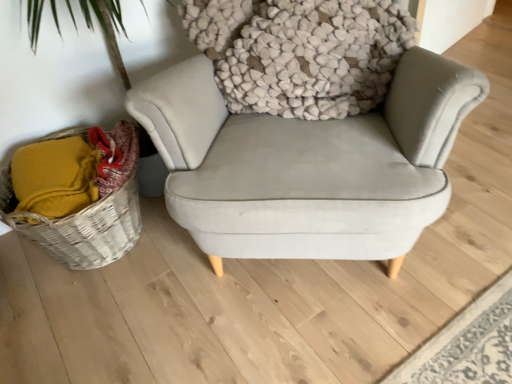
What is the approximate height of woven wicker basket at lower left?

woven wicker basket at lower left is 14.89 inches in height.

Where is `woven wicker basket at lower left`? The image size is (512, 384). woven wicker basket at lower left is located at coordinates (83, 227).

Describe the element at coordinates (83, 227) in the screenshot. I see `woven wicker basket at lower left` at that location.

This screenshot has width=512, height=384. Identify the location of woven wicker basket at lower left. (83, 227).